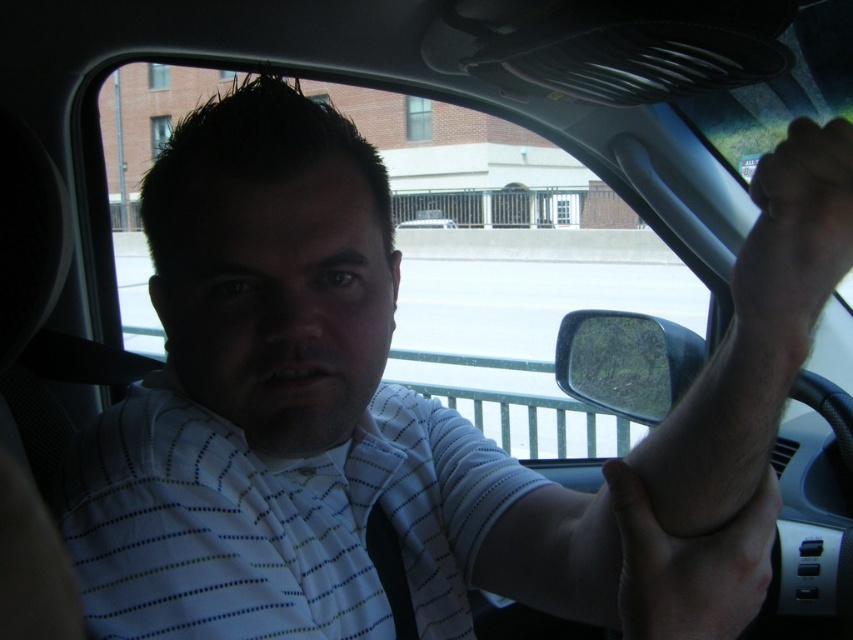
Can you confirm if smooth skin hand at center is shorter than clear plastic side mirror at right?

Correct, smooth skin hand at center is not as tall as clear plastic side mirror at right.

Does point (676, 602) come in front of point (561, 385)?

Yes, it is.

Image resolution: width=853 pixels, height=640 pixels. Describe the element at coordinates (689, 564) in the screenshot. I see `smooth skin hand at center` at that location.

Find the location of a particular element. smooth skin hand at center is located at coordinates (689, 564).

Between point (782, 161) and point (602, 333), which one is positioned in front?

Point (782, 161) is in front.

Which is above, dark skin/hair at upper right or clear plastic side mirror at right?

dark skin/hair at upper right is higher up.

Where is `dark skin/hair at upper right`? dark skin/hair at upper right is located at coordinates (798, 225).

Image resolution: width=853 pixels, height=640 pixels. I want to click on dark skin/hair at upper right, so click(x=798, y=225).

Can you confirm if clear plastic side mirror at right is smaller than white matte car at center?

Yes.

Who is more distant from viewer, (572,365) or (422,227)?

The point (422,227) is more distant.

Between point (648, 380) and point (450, 227), which one is positioned behind?

Point (450, 227)

Find the location of `clear plastic side mirror at right`. clear plastic side mirror at right is located at coordinates (625, 362).